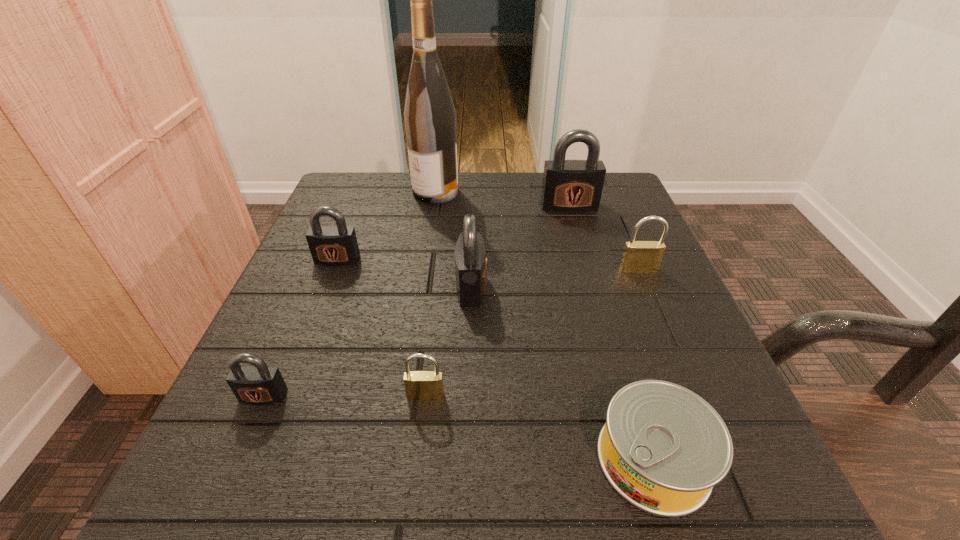
The width and height of the screenshot is (960, 540). What are the coordinates of `empty space between the smaller brass padlock and the bigger brass padlock` in the screenshot? It's located at (532, 332).

In order to click on free point between the tallest object and the nearest object in this screenshot , I will do `click(544, 326)`.

Identify the location of vacant area between the smaller brass padlock and the biggest gray padlock. The image size is (960, 540). (497, 300).

You are a GUI agent. You are given a task and a screenshot of the screen. Output one action in this format:
    pyautogui.click(x=<x>, y=<y>)
    Task: Click on the object that is the fifth closest to the nearer brass padlock
    The height and width of the screenshot is (540, 960).
    Given the screenshot: What is the action you would take?
    pyautogui.click(x=638, y=256)

Locate an element on the screen. object that stands as the fourth closest to the second tallest padlock is located at coordinates (430, 122).

Where is `the third closest padlock to the second farthest gray padlock`? the third closest padlock to the second farthest gray padlock is located at coordinates (419, 385).

Locate an element on the screen. This screenshot has width=960, height=540. padlock that is the third closest to the second biggest gray padlock is located at coordinates (571, 186).

Where is `gray padlock that is the second closest one to the nearest gray padlock`? The width and height of the screenshot is (960, 540). gray padlock that is the second closest one to the nearest gray padlock is located at coordinates (470, 253).

At what (x,y) coordinates should I click in order to perform the action: click on gray padlock that is the second closest to the farthest gray padlock. Please return your answer as a coordinate pair (x, y). Looking at the image, I should click on (333, 245).

Find the location of a particular element. free location that satisfies the following two spatial constraints: 1. on the front-facing side of the right brass padlock; 2. on the front of the third tallest object near the keyhole is located at coordinates (646, 287).